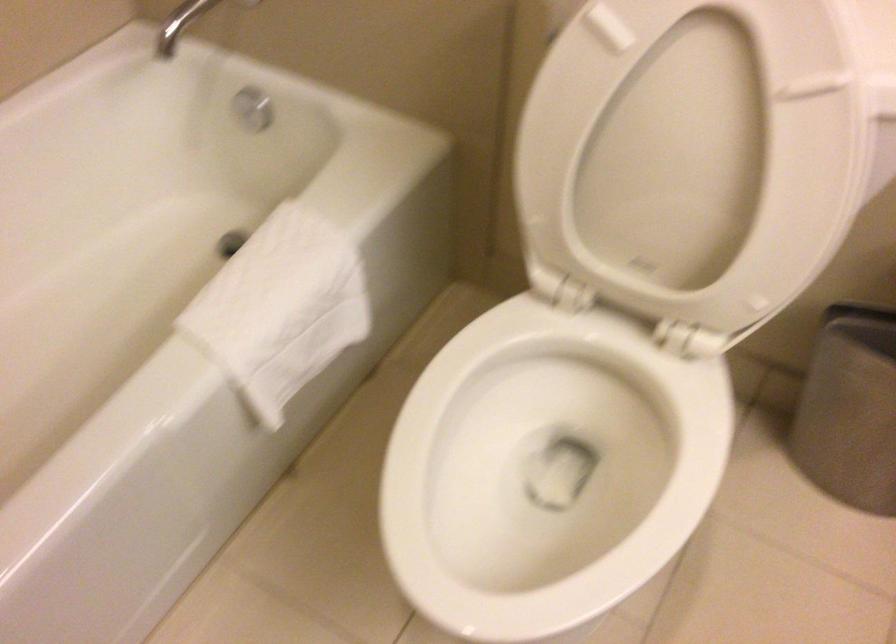
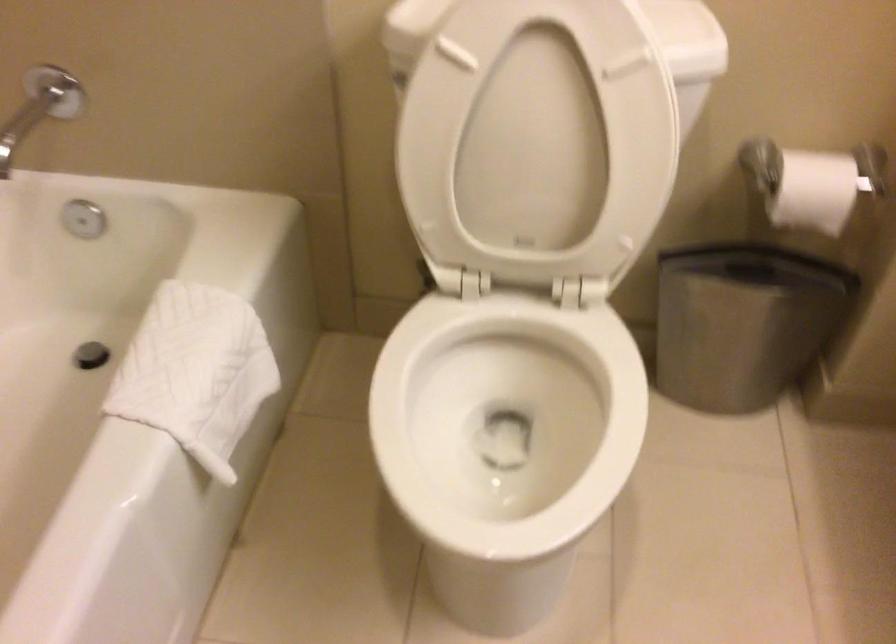
In the second image, find the point that corresponds to point (247, 109) in the first image.

(83, 219)